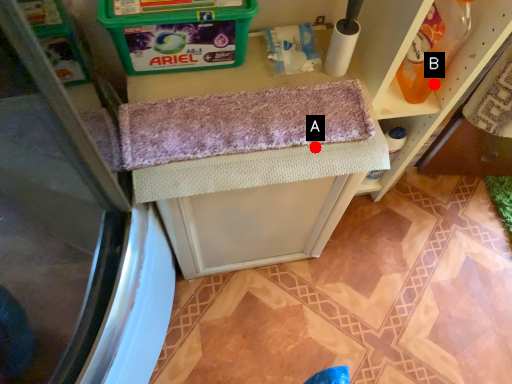
Question: Two points are circled on the image, labeled by A and B beside each circle. Which point appears farthest from the camera in this image?

Choices:
 (A) A is further
 (B) B is further

Answer: (B)